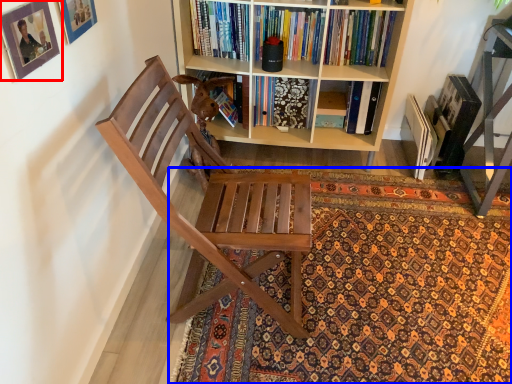
Question: Which object appears closest to the camera in this image, picture frame (highlighted by a red box) or mat (highlighted by a blue box)?

Choices:
 (A) picture frame
 (B) mat

Answer: (A)